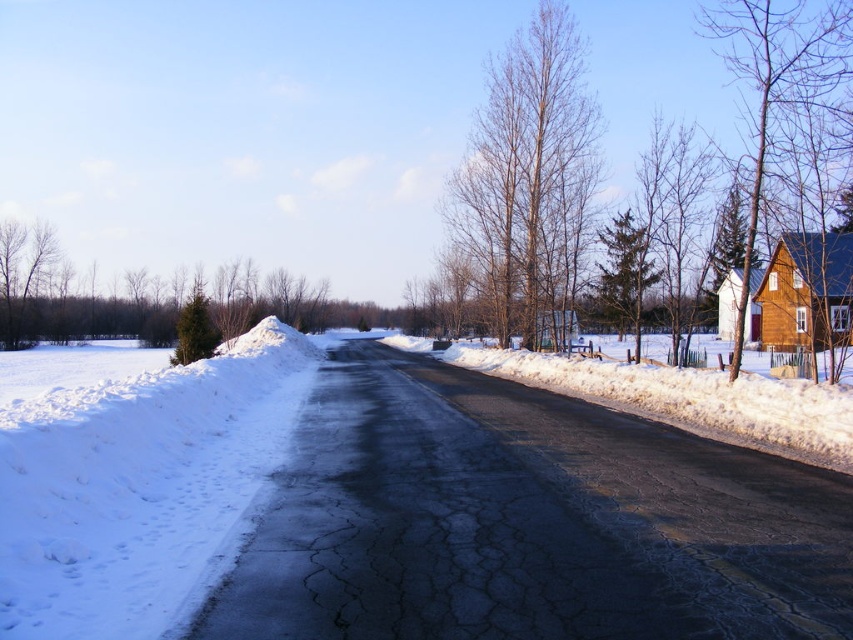
Does bare branches at upper center have a larger size compared to green matte evergreen tree at left?

Correct, bare branches at upper center is larger in size than green matte evergreen tree at left.

Does point (550, 180) lie in front of point (213, 337)?

That is False.

This screenshot has width=853, height=640. I want to click on bare branches at upper center, so pos(527,177).

Consider the image. Between bare wood tree at right and green textured evergreen tree at center-right, which one appears on the left side from the viewer's perspective?

green textured evergreen tree at center-right

Is bare wood tree at right above green textured evergreen tree at center-right?

Yes, bare wood tree at right is above green textured evergreen tree at center-right.

I want to click on bare wood tree at right, so click(x=766, y=88).

Where is `bare wood tree at right`? This screenshot has width=853, height=640. bare wood tree at right is located at coordinates (766, 88).

Which of these two, white powdery snow at center or white fluffy snow at left, stands shorter?

With less height is white fluffy snow at left.

Between white powdery snow at center and white fluffy snow at left, which one is positioned lower?

white powdery snow at center is lower down.

Measure the distance between white powdery snow at center and camera.

white powdery snow at center is 13.93 feet from camera.

You are a GUI agent. You are given a task and a screenshot of the screen. Output one action in this format:
    pyautogui.click(x=<x>, y=<y>)
    Task: Click on the white powdery snow at center
    
    Given the screenshot: What is the action you would take?
    pyautogui.click(x=398, y=509)